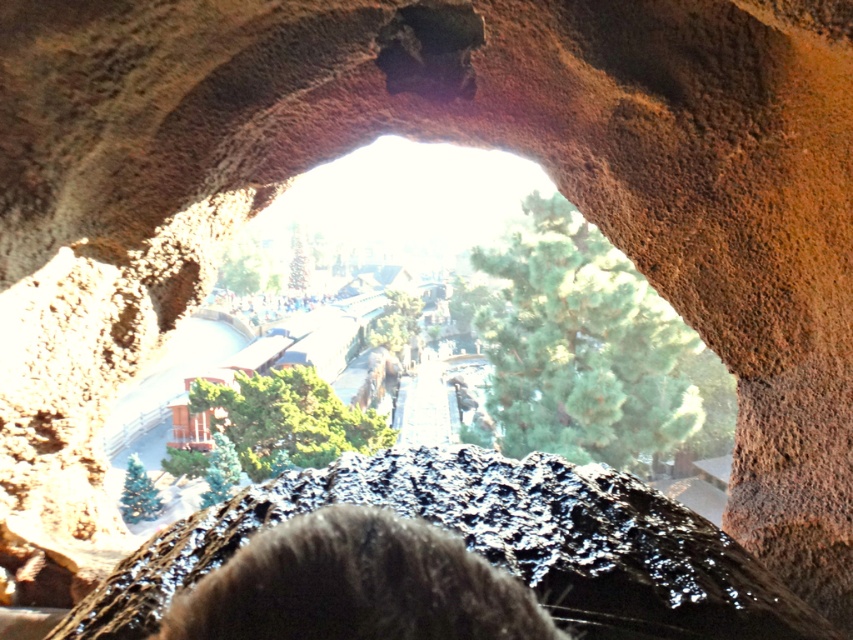
Question: Estimate the real-world distances between objects in this image. Which object is farther from the black matte coal at center?

Choices:
 (A) matte black crowd at center
 (B) brown rough rock at center

Answer: (B)

Question: Which object appears farthest from the camera in this image?

Choices:
 (A) black matte coal at center
 (B) matte black crowd at center

Answer: (B)

Question: Is black matte coal at center to the right of matte black crowd at center from the viewer's perspective?

Choices:
 (A) yes
 (B) no

Answer: (A)

Question: Does black matte coal at center have a lesser width compared to brown rough rock at center?

Choices:
 (A) no
 (B) yes

Answer: (B)

Question: Is the position of black matte coal at center more distant than that of matte black crowd at center?

Choices:
 (A) no
 (B) yes

Answer: (A)

Question: Which point is farther to the camera?

Choices:
 (A) (241, 301)
 (B) (500, 560)

Answer: (A)